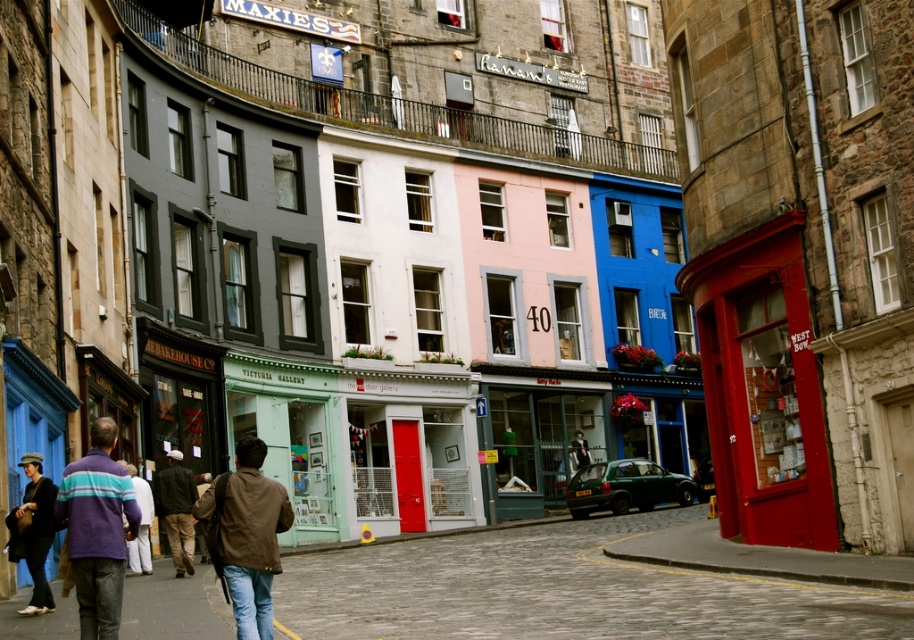
You are a tourist standing on the striped wool sweater at lower left and want to walk towards the cobblestone pavement at center. Which direction should you move?

The cobblestone pavement at center is to the right of the striped wool sweater at lower left, so you should move to your right to reach it.

You are a delivery person carrying a package that is 1.2 meters wide. You need to walk through the street shown in the image. Can you pass through the area between the cobblestone pavement at center and the striped wool sweater at lower left without tilting the package?

The cobblestone pavement at center is wider than the striped wool sweater at lower left. However, the exact width of the path between them isn